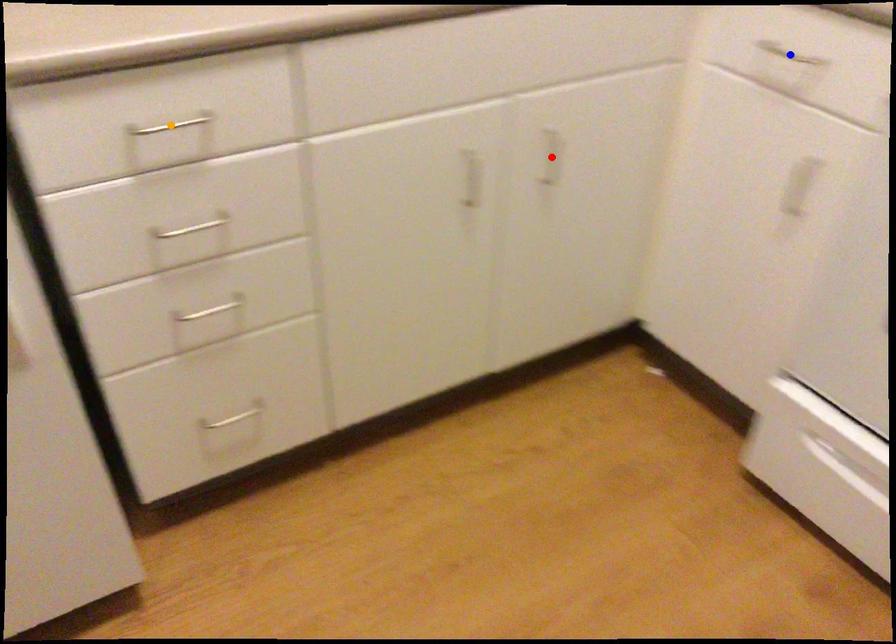
Order these from nearest to farthest:
A) blue point
B) orange point
C) red point

orange point, blue point, red point